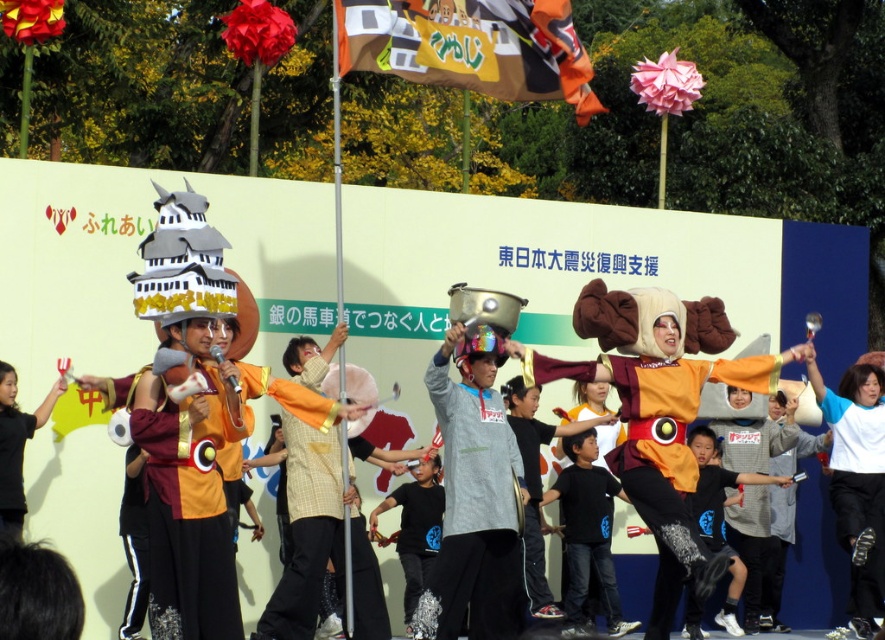
Question: Which of these objects is positioned closest to the black fabric shirt at left?

Choices:
 (A) black matte shirt at center
 (B) cardboard banner at upper center

Answer: (B)

Question: Is cardboard banner at upper center to the right of black fabric shirt at left from the viewer's perspective?

Choices:
 (A) no
 (B) yes

Answer: (B)

Question: Which object appears closest to the camera in this image?

Choices:
 (A) cardboard banner at upper center
 (B) black fabric shirt at left
 (C) black matte shirt at center

Answer: (A)

Question: Which point is farther to the camera?

Choices:
 (A) black fabric shirt at left
 (B) cardboard banner at upper center
 (C) black matte shirt at center

Answer: (C)

Question: Can you confirm if cardboard banner at upper center is bigger than black fabric shirt at left?

Choices:
 (A) no
 (B) yes

Answer: (B)

Question: From the image, what is the correct spatial relationship of cardboard banner at upper center in relation to black fabric shirt at left?

Choices:
 (A) left
 (B) right

Answer: (B)